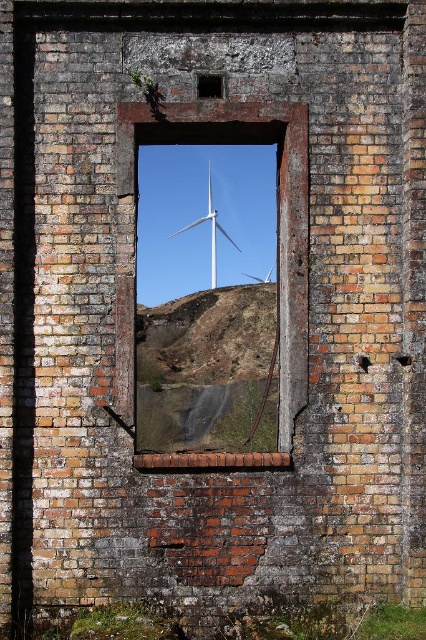
Question: Is brick at center positioned at the back of white matte wind turbine at center?

Choices:
 (A) yes
 (B) no

Answer: (B)

Question: Is brick at center to the left of white matte wind turbine at center from the viewer's perspective?

Choices:
 (A) no
 (B) yes

Answer: (A)

Question: Among these objects, which one is farthest from the camera?

Choices:
 (A) brick at center
 (B) white matte wind turbine at center

Answer: (B)

Question: Can you confirm if brick at center is positioned to the left of white matte wind turbine at center?

Choices:
 (A) no
 (B) yes

Answer: (A)

Question: Which of the following is the farthest from the observer?

Choices:
 (A) brick at center
 (B) white matte wind turbine at center

Answer: (B)